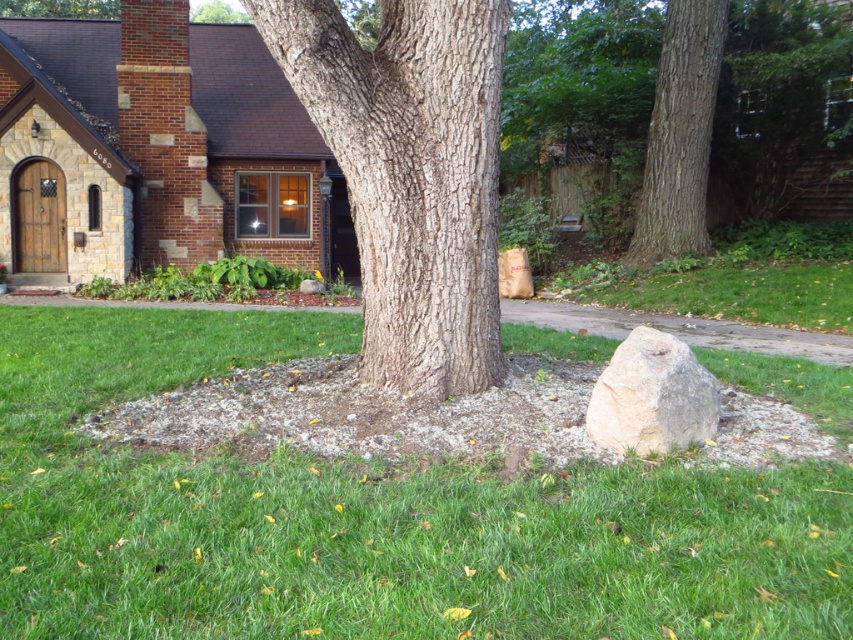
You are standing in the yard looking at the green grass at center and the smooth beige rock at center. Which object is closer to the ground?

The green grass at center is located below the smooth beige rock at center, so it is closer to the ground.

You are a window cleaner standing at the base of the smooth bark tree at center and the rough bark tree trunk at upper center. You need to clean the windows of the house behind them. Which tree trunk do you need to climb to reach the lower branches to get a better view of the windows?

The smooth bark tree at center has a lesser height compared to the rough bark tree trunk at upper center, so you should climb the smooth bark tree at center to reach the lower branches and get a better view of the windows.

You are standing in the suburban yard and want to locate the point marked at coordinates (410, 173). Based on the scene description, where exactly would this point be located?

The point marked at coordinates (410, 173) is located on the smooth bark tree at center.